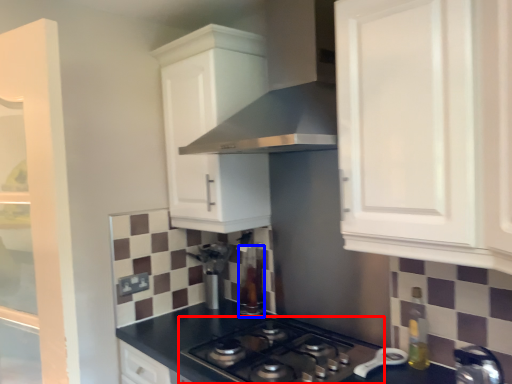
Question: Which point is closer to the camera, gas stove (highlighted by a red box) or appliance (highlighted by a blue box)?

Choices:
 (A) gas stove
 (B) appliance

Answer: (A)